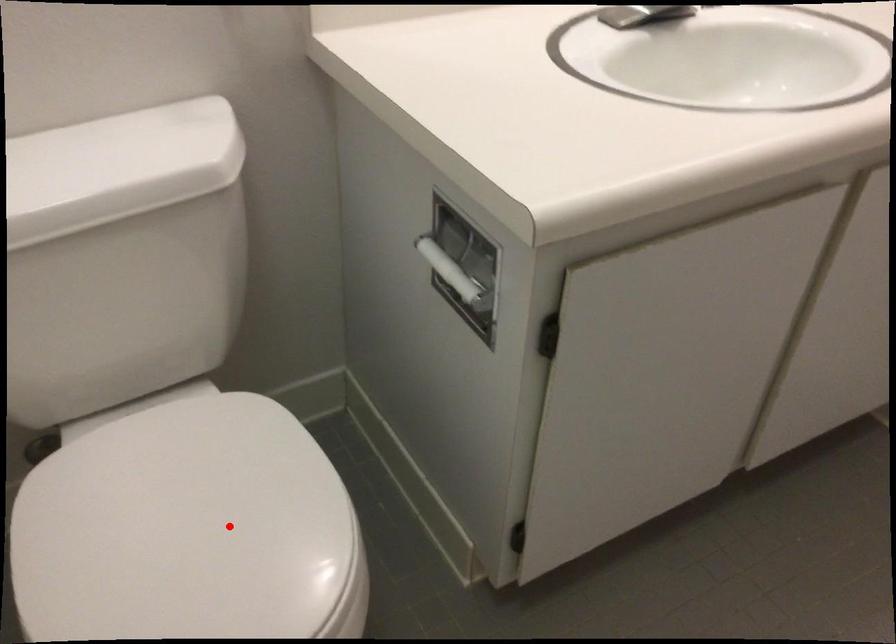
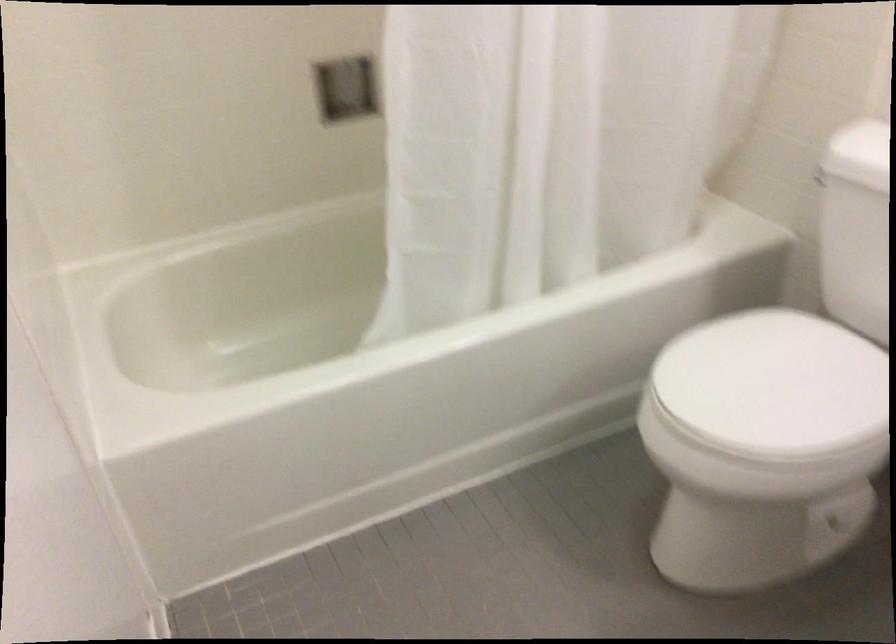
Question: I am providing you with two images of the same scene from different viewpoints. In image1, a red point is highlighted. Considering the same 3D point in image2, which of the following is correct?

Choices:
 (A) It is closer
 (B) It is farther

Answer: (B)